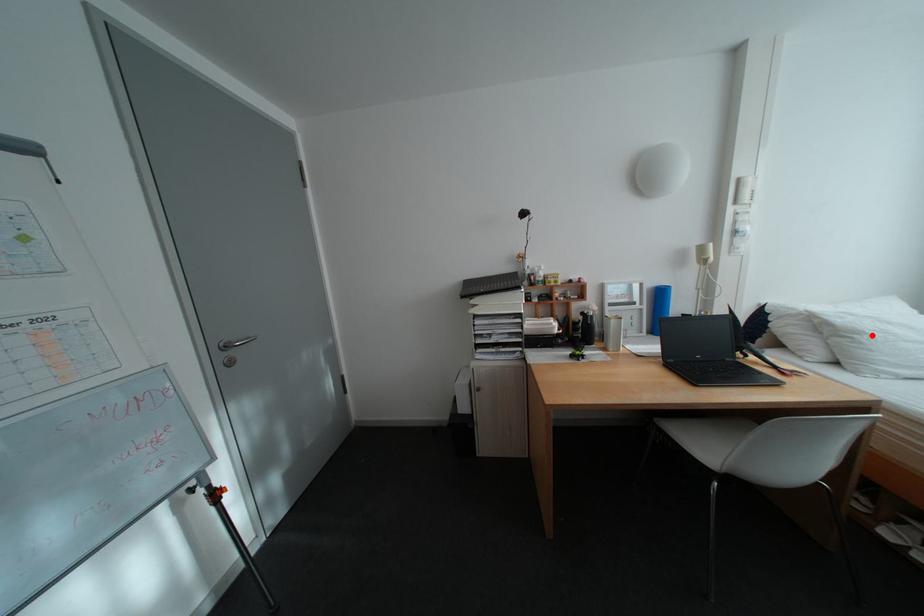
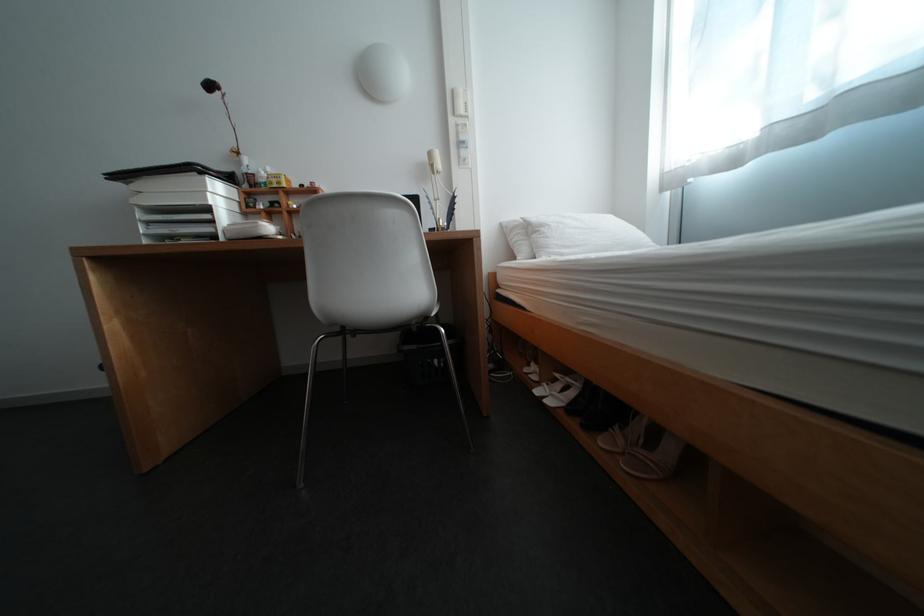
The point at the highlighted location is marked in the first image. Where is the corresponding point in the second image?

(555, 228)